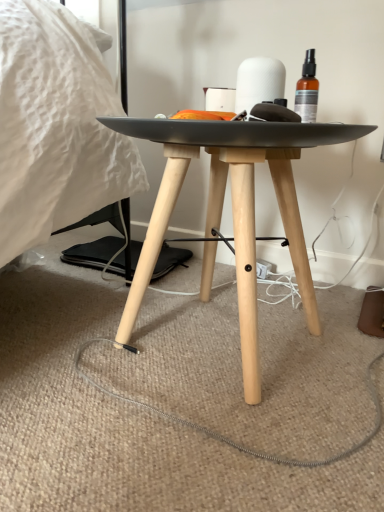
Where is `vacant space underneath matte black table at center (from a real-world perspective)`? Image resolution: width=384 pixels, height=512 pixels. vacant space underneath matte black table at center (from a real-world perspective) is located at coordinates (213, 346).